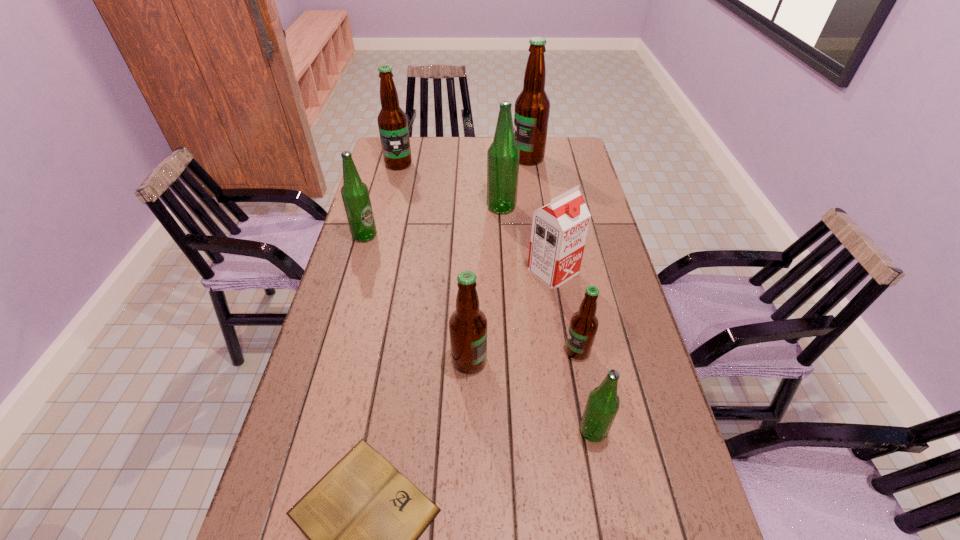
Identify the location of vacant space located 0.060m on the label of the sixth object from right to left. The image size is (960, 540). (511, 361).

The height and width of the screenshot is (540, 960). Identify the location of vacant position located on the label of the second nearest green beer bottle. (467, 236).

Image resolution: width=960 pixels, height=540 pixels. I want to click on vacant point located on the front of the soya milk, so click(572, 389).

At what (x,y) coordinates should I click in order to perform the action: click on vacant space located on the label of the smallest brown beer bottle. Please return your answer as a coordinate pair (x, y). The image size is (960, 540). Looking at the image, I should click on (529, 350).

Locate an element on the screen. The height and width of the screenshot is (540, 960). free space located 0.280m on the label of the smallest brown beer bottle is located at coordinates (454, 350).

Where is `free space located 0.390m on the label of the smallest brown beer bottle`? The height and width of the screenshot is (540, 960). free space located 0.390m on the label of the smallest brown beer bottle is located at coordinates (411, 350).

Identify the location of vacant region located 0.180m on the label of the nearest green beer bottle. This screenshot has height=540, width=960. (497, 431).

Locate an element on the screen. The width and height of the screenshot is (960, 540). vacant space situated 0.290m on the label of the nearest green beer bottle is located at coordinates (447, 431).

This screenshot has width=960, height=540. I want to click on vacant space located on the label of the nearest green beer bottle, so click(x=492, y=431).

This screenshot has height=540, width=960. Find the location of `soya milk located in the right edge section of the desktop`. soya milk located in the right edge section of the desktop is located at coordinates (559, 230).